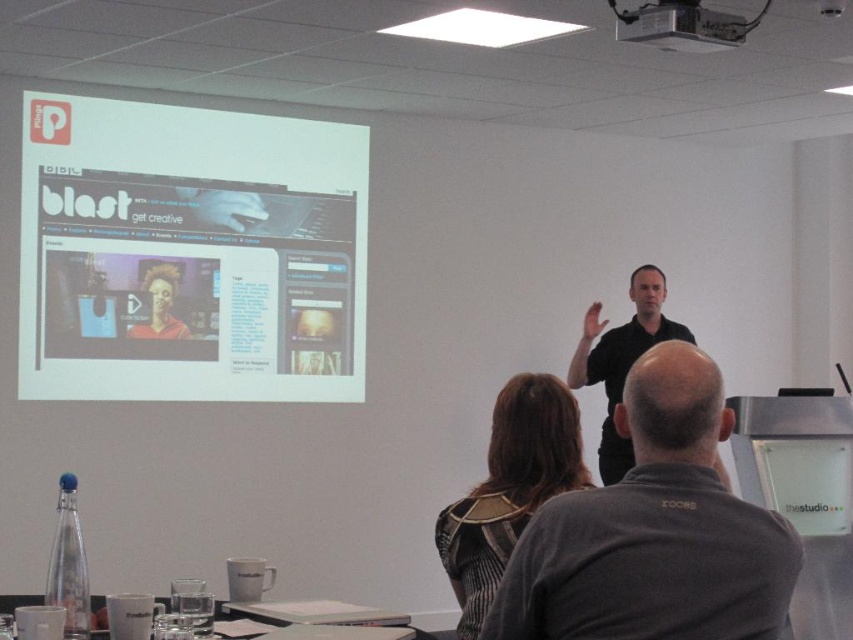
Question: Observing the image, what is the correct spatial positioning of striped fabric dress at center in reference to black matte shirt at center?

Choices:
 (A) right
 (B) left

Answer: (B)

Question: Which object is farther from the camera taking this photo?

Choices:
 (A) metallic projector at upper center
 (B) white matte projection screen at upper left

Answer: (B)

Question: Estimate the real-world distances between objects in this image. Which object is closer to the metallic projector at upper center?

Choices:
 (A) black shirt at center
 (B) striped fabric dress at center
 (C) matte black mannequin at center
 (D) white matte projection screen at upper left

Answer: (B)

Question: Can you confirm if white matte projection screen at upper left is wider than black matte shirt at center?

Choices:
 (A) no
 (B) yes

Answer: (B)

Question: Which point is closer to the camera?

Choices:
 (A) striped fabric dress at center
 (B) white matte projection screen at upper left
 (C) matte black mannequin at center
 (D) metallic projector at upper center

Answer: (A)

Question: Observing the image, what is the correct spatial positioning of black matte shirt at center in reference to matte black mannequin at center?

Choices:
 (A) right
 (B) left

Answer: (A)